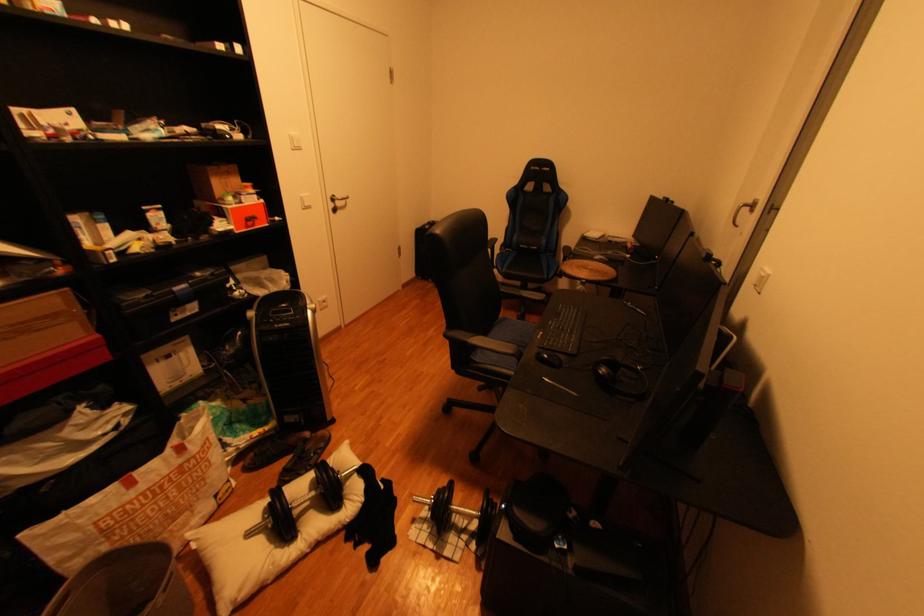
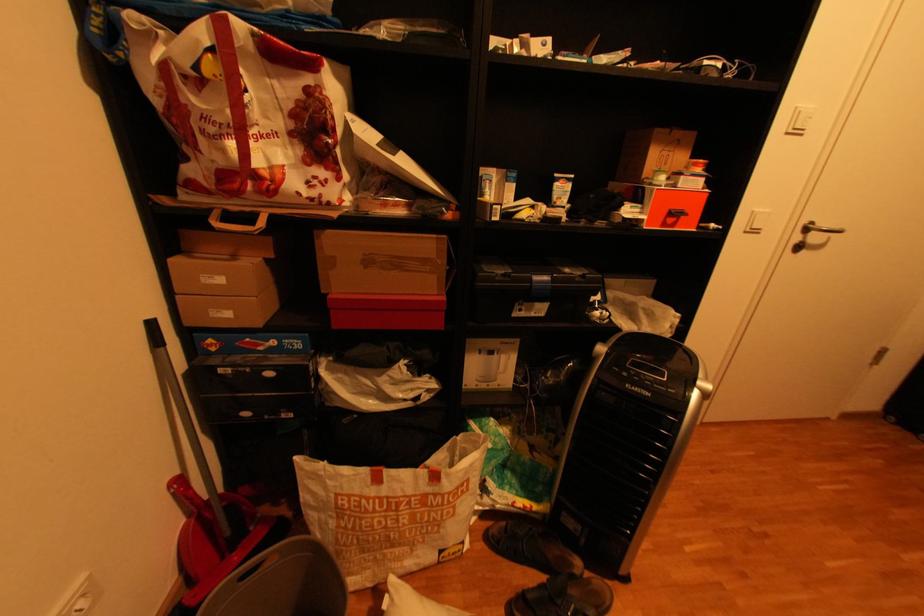
In the second image, find the point that corresponds to (68,294) in the first image.

(446, 238)